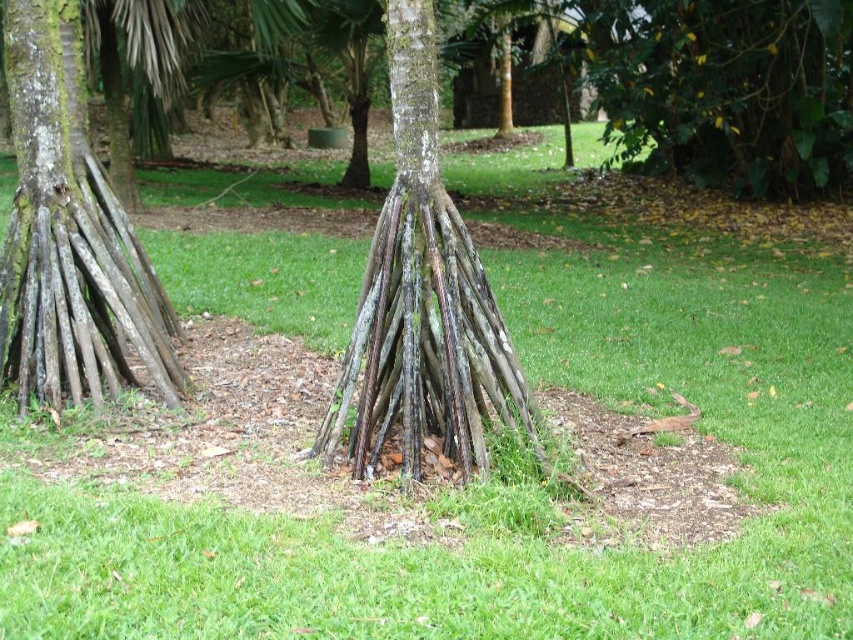
Question: Can you confirm if smooth brown wood at left is positioned to the left of brown rough textured roots at center?

Choices:
 (A) yes
 (B) no

Answer: (A)

Question: Which point appears closest to the camera in this image?

Choices:
 (A) (503, 355)
 (B) (30, 84)

Answer: (A)

Question: Is smooth brown wood at left to the left of brown rough textured roots at center from the viewer's perspective?

Choices:
 (A) no
 (B) yes

Answer: (B)

Question: Can you confirm if smooth brown wood at left is positioned below brown rough textured roots at center?

Choices:
 (A) no
 (B) yes

Answer: (A)

Question: Which point appears closest to the camera in this image?

Choices:
 (A) (86, 212)
 (B) (428, 262)

Answer: (B)